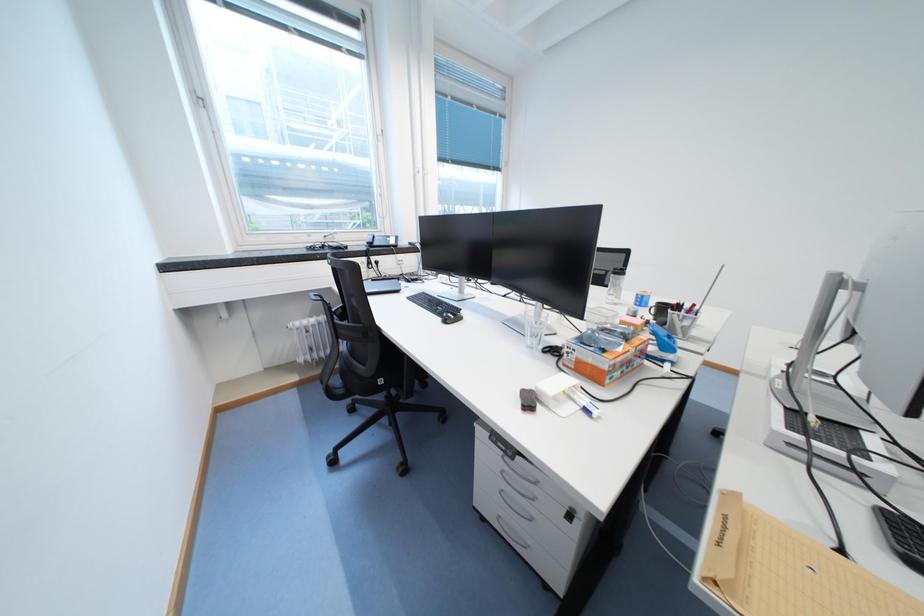
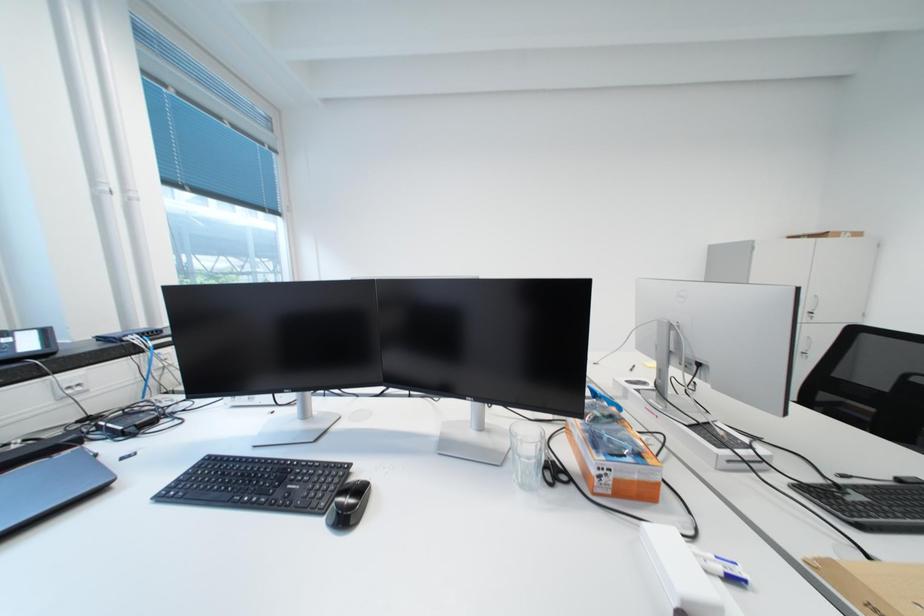
Question: The first image is from the beginning of the video and the second image is from the end. How did the camera likely rotate when shooting the video?

Choices:
 (A) Left
 (B) Right
 (C) Up
 (D) Down

Answer: (B)